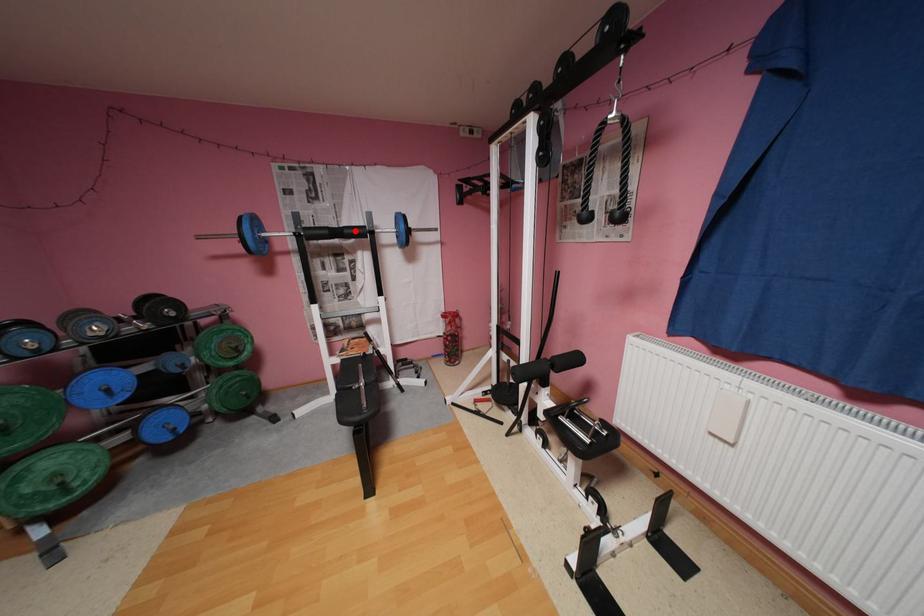
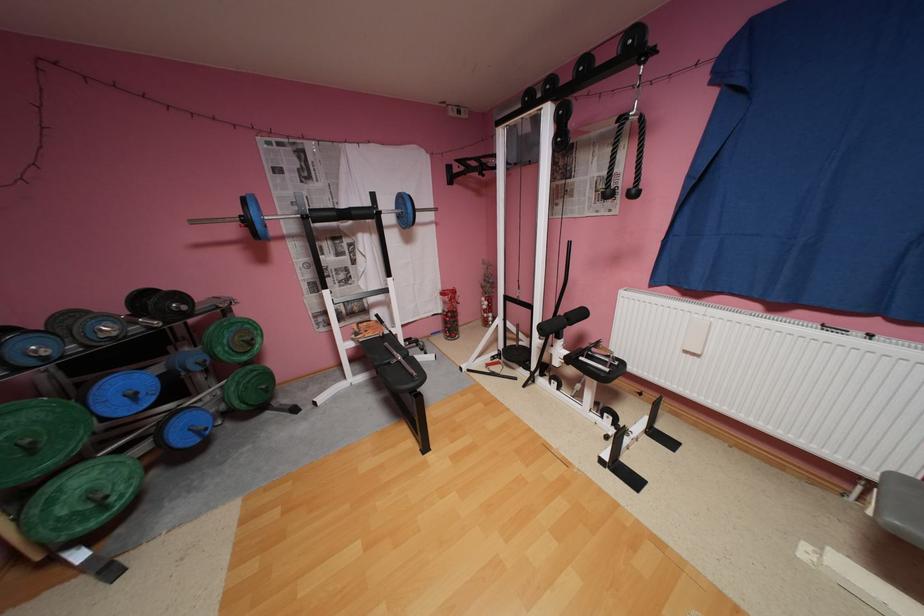
The point at the highlighted location is marked in the first image. Where is the corresponding point in the second image?

(362, 213)